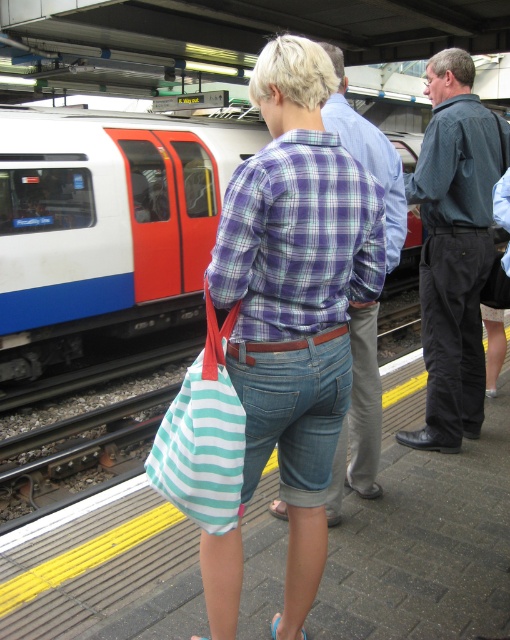
You are standing at the train station platform and see the white glossy train at upper left. If you were to walk directly towards the train, which direction should you move relative to your current position?

Since the white glossy train at upper left is located at point coordinates of 0.353 on the x axis and 0.206 on the y axis, you should move towards the upper left direction to reach it.

You are standing on the platform and want to compare the sizes of the white glossy train at upper left and the teal striped fabric bag at center. Which one is wider?

The white glossy train at upper left is wider than the teal striped fabric bag at center because its width surpasses the bag.